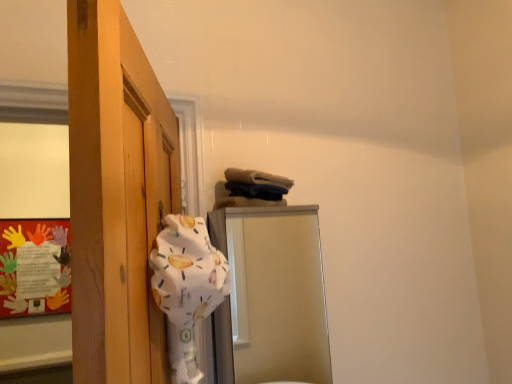
Question: Is white fabric at left facing towards multicolored paper at left?

Choices:
 (A) yes
 (B) no

Answer: (B)

Question: Is multicolored paper at left located within white fabric at left?

Choices:
 (A) yes
 (B) no

Answer: (B)

Question: Considering the relative positions of white fabric at left and multicolored paper at left in the image provided, is white fabric at left to the right of multicolored paper at left from the viewer's perspective?

Choices:
 (A) yes
 (B) no

Answer: (A)

Question: Can you confirm if white fabric at left is thinner than multicolored paper at left?

Choices:
 (A) no
 (B) yes

Answer: (A)

Question: Is white fabric at left shorter than multicolored paper at left?

Choices:
 (A) no
 (B) yes

Answer: (B)

Question: Is the depth of white fabric at left greater than that of multicolored paper at left?

Choices:
 (A) no
 (B) yes

Answer: (A)

Question: Is metallic silver mirror at center wider than multicolored paper at left?

Choices:
 (A) yes
 (B) no

Answer: (A)

Question: Would you say metallic silver mirror at center contains multicolored paper at left?

Choices:
 (A) yes
 (B) no

Answer: (B)

Question: Is metallic silver mirror at center positioned before multicolored paper at left?

Choices:
 (A) yes
 (B) no

Answer: (A)

Question: From a real-world perspective, is metallic silver mirror at center below multicolored paper at left?

Choices:
 (A) no
 (B) yes

Answer: (B)

Question: Can you see metallic silver mirror at center touching multicolored paper at left?

Choices:
 (A) yes
 (B) no

Answer: (B)

Question: Does metallic silver mirror at center have a larger size compared to multicolored paper at left?

Choices:
 (A) no
 (B) yes

Answer: (B)

Question: From the image's perspective, is multicolored paper at left under metallic silver mirror at center?

Choices:
 (A) yes
 (B) no

Answer: (A)